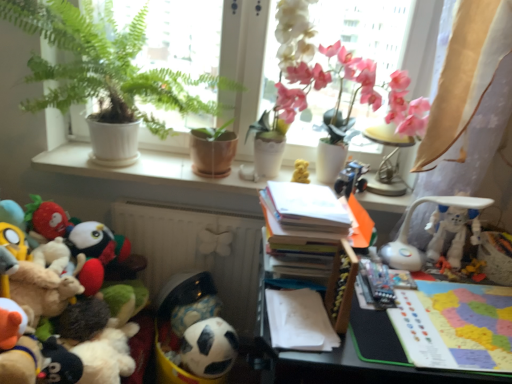
Question: Does white paper book at center, arranged as the 1th book when viewed from the top, have a lesser width compared to smooth plastic table at lower right?

Choices:
 (A) no
 (B) yes

Answer: (B)

Question: Is white paper book at center, the 2th book positioned from the right, located outside smooth plastic table at lower right?

Choices:
 (A) no
 (B) yes

Answer: (B)

Question: Is smooth plastic table at lower right a part of white paper book at center, the first book from the left?

Choices:
 (A) no
 (B) yes

Answer: (A)

Question: Considering the relative positions of white paper book at center, the first book from the left, and smooth plastic table at lower right in the image provided, is white paper book at center, the first book from the left, behind smooth plastic table at lower right?

Choices:
 (A) no
 (B) yes

Answer: (B)

Question: From a real-world perspective, is white paper book at center, arranged as the 1th book when viewed from the top, physically below smooth plastic table at lower right?

Choices:
 (A) no
 (B) yes

Answer: (A)

Question: From a real-world perspective, does white paper book at center, which appears as the second book when ordered from the bottom, stand above smooth plastic table at lower right?

Choices:
 (A) yes
 (B) no

Answer: (A)

Question: Is multicolored paper map at right, which appears as the 1th book when viewed from the right, completely or partially inside beige sheer curtain at upper right?

Choices:
 (A) no
 (B) yes

Answer: (A)

Question: Is beige sheer curtain at upper right positioned before multicolored paper map at right, which appears as the 1th book when viewed from the right?

Choices:
 (A) no
 (B) yes

Answer: (A)

Question: From a real-world perspective, is beige sheer curtain at upper right positioned over multicolored paper map at right, which is the first book in bottom-to-top order, based on gravity?

Choices:
 (A) yes
 (B) no

Answer: (A)

Question: Is beige sheer curtain at upper right turned away from multicolored paper map at right, which appears as the 1th book when viewed from the right?

Choices:
 (A) yes
 (B) no

Answer: (B)

Question: Does beige sheer curtain at upper right have a greater width compared to multicolored paper map at right, which appears as the 1th book when viewed from the right?

Choices:
 (A) yes
 (B) no

Answer: (B)

Question: From the image's perspective, is beige sheer curtain at upper right located beneath multicolored paper map at right, the 2th book when ordered from left to right?

Choices:
 (A) yes
 (B) no

Answer: (B)

Question: Does pink silk orchid at upper right touch white plastic robot at right, which is the sixth toy from left to right?

Choices:
 (A) yes
 (B) no

Answer: (B)